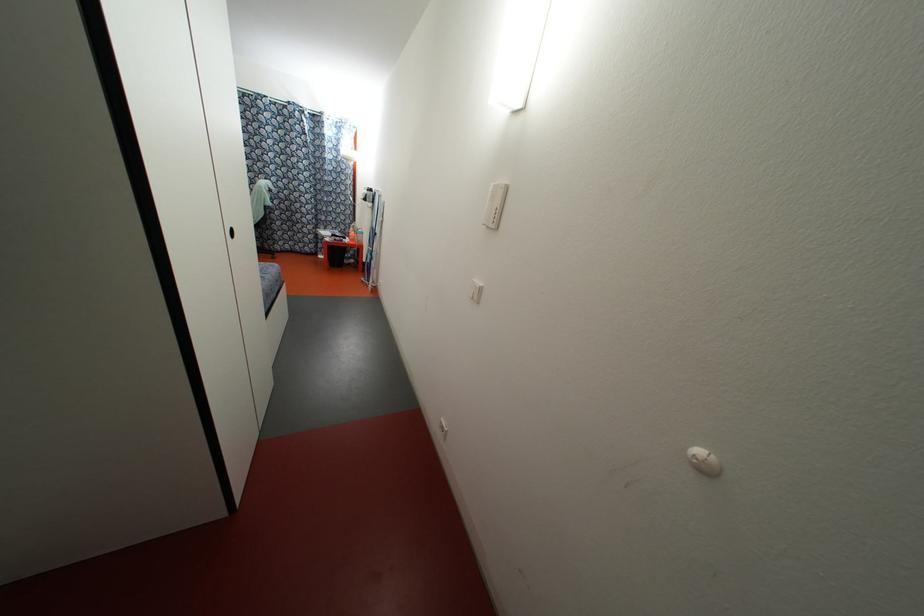
Where would you push the white light switch? Please return your answer as a coordinate pair (x, y).

(476, 291)